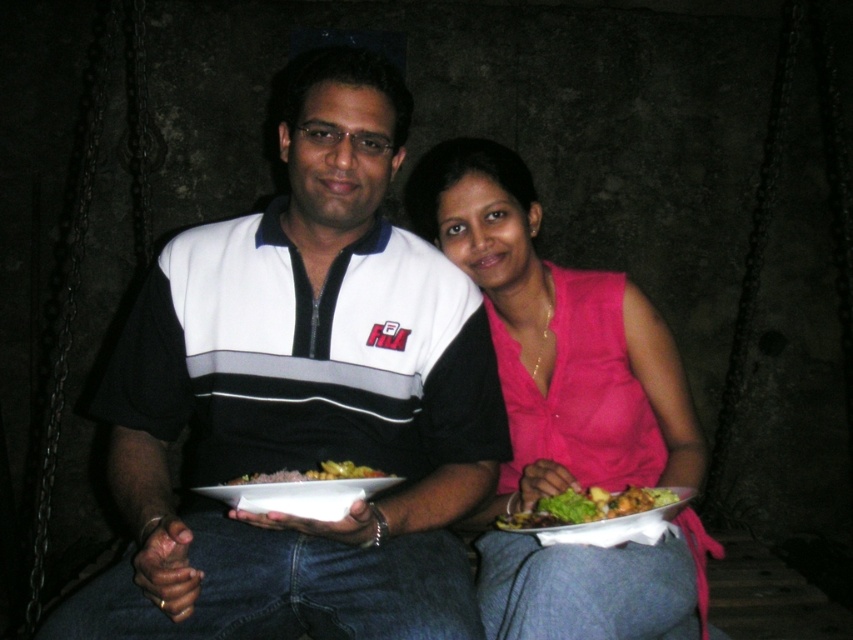
Question: Which object appears closest to the camera in this image?

Choices:
 (A) pink fabric shirt at center
 (B) white glossy plate at center
 (C) brown matte rice at center
 (D) white striped polo shirt at center

Answer: (B)

Question: Observing the image, what is the correct spatial positioning of white striped polo shirt at center in reference to brown matte rice at center?

Choices:
 (A) left
 (B) right

Answer: (A)

Question: Does white striped polo shirt at center have a lesser width compared to brown matte rice at center?

Choices:
 (A) yes
 (B) no

Answer: (B)

Question: Is pink fabric shirt at center further to the viewer compared to brown matte rice at center?

Choices:
 (A) yes
 (B) no

Answer: (A)

Question: Which point appears farthest from the camera in this image?

Choices:
 (A) (347, 468)
 (B) (606, 509)

Answer: (B)

Question: Which point appears closest to the camera in this image?

Choices:
 (A) (306, 484)
 (B) (424, 445)
 (C) (567, 577)
 (D) (340, 476)

Answer: (A)